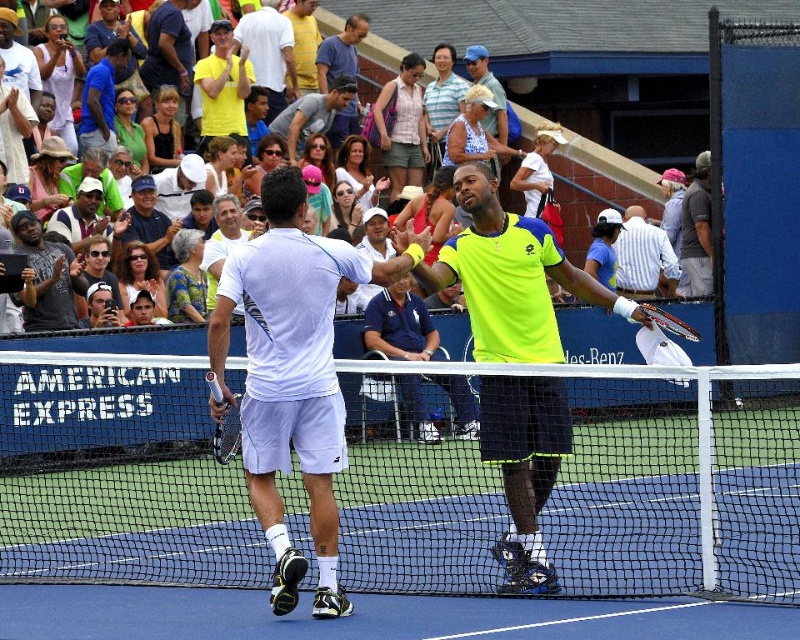
Question: Is the position of matte black jacket at left less distant than that of matte blue shirt at upper center?

Choices:
 (A) no
 (B) yes

Answer: (B)

Question: Does black mesh net at center appear on the left side of white cotton shirt at upper center?

Choices:
 (A) no
 (B) yes

Answer: (A)

Question: Which point is farther to the camera?

Choices:
 (A) neon yellow shirt at center
 (B) black mesh net at center

Answer: (A)

Question: Estimate the real-world distances between objects in this image. Which object is closer to the white cotton shirt at upper center?

Choices:
 (A) white matte tennis racket at center
 (B) white matte shorts at center

Answer: (B)

Question: Which point is closer to the camera?

Choices:
 (A) matte blue shirt at upper center
 (B) white matte tennis racket at center
 (C) metallic silver tennis racket at center
 (D) white matte shorts at center

Answer: (D)

Question: Does white matte shorts at center lie behind metallic silver tennis racket at center?

Choices:
 (A) yes
 (B) no

Answer: (B)